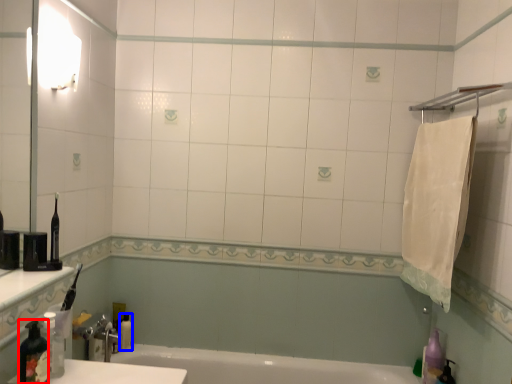
Question: Which of the following is the farthest to the observer, bottle (highlighted by a red box) or toiletry (highlighted by a blue box)?

Choices:
 (A) bottle
 (B) toiletry

Answer: (B)